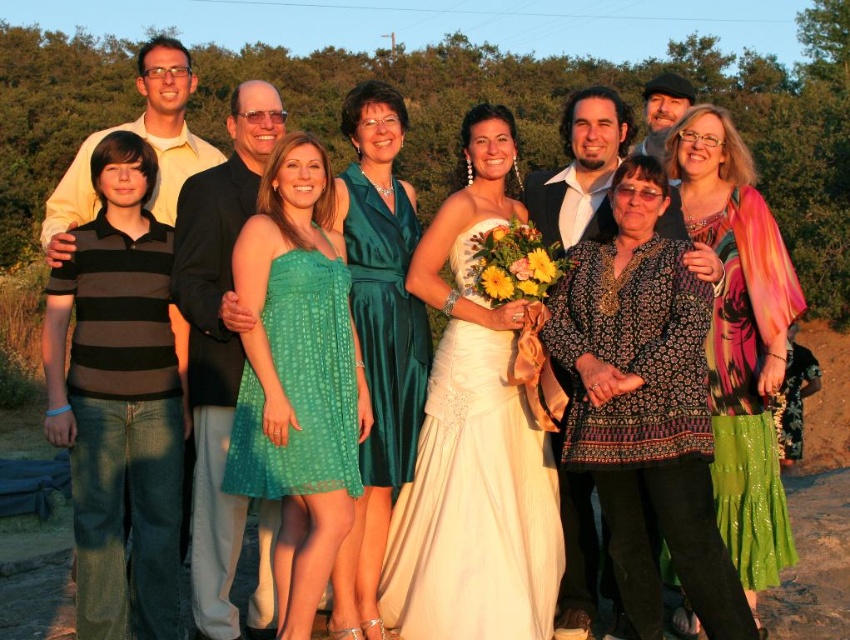
In the celebratory outdoor scene with a bride in a white gown holding yellow flowers, there are two dresses at the center. The green satin dress at center and the emerald satin dress at center. Which dress is positioned higher in the image?

The green satin dress at center is located above the emerald satin dress at center, so the green satin dress at center is positioned higher in the image.

You are standing at the center of the image. Looking at the green satin dress at center, what are its coordinates in the image?

The green satin dress at center is located at coordinates point (378, 340).

Based on the scene description, if you are standing facing the group, which object is positioned to the left of the other between the green satin dress at center and the black textured hat at upper right?

The green satin dress at center is to the left of the black textured hat at upper right.